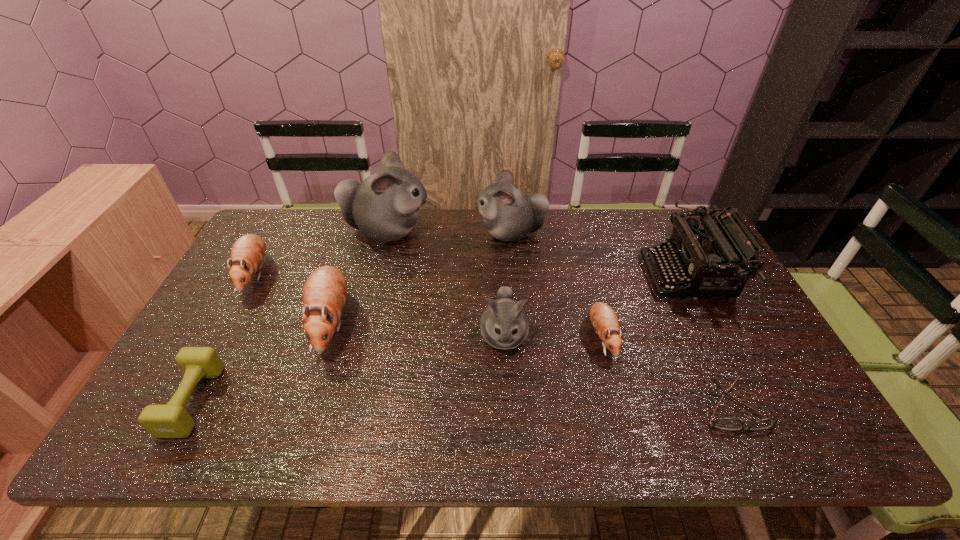
Identify the location of free spot located 0.170m at the face of the biggest brown hamster. Image resolution: width=960 pixels, height=540 pixels. (296, 430).

Find the location of a particular element. The height and width of the screenshot is (540, 960). free location located 0.240m at the face of the second smallest brown hamster is located at coordinates (201, 373).

Where is `blank space located 0.140m at the face of the shortest hamster`? The image size is (960, 540). blank space located 0.140m at the face of the shortest hamster is located at coordinates (622, 416).

Locate an element on the screen. This screenshot has width=960, height=540. free location located on the back of the dumbbell is located at coordinates (252, 288).

The image size is (960, 540). In order to click on typewriter at the far edge in this screenshot , I will do `click(695, 255)`.

I want to click on dumbbell located in the near edge section of the desktop, so click(171, 420).

At what (x,y) coordinates should I click in order to perform the action: click on spectacles present at the near edge. Please return your answer as a coordinate pair (x, y). Looking at the image, I should click on (723, 423).

The image size is (960, 540). I want to click on hamster located in the left edge section of the desktop, so click(247, 254).

Image resolution: width=960 pixels, height=540 pixels. What are the coordinates of `dumbbell that is at the left edge` in the screenshot? It's located at (171, 420).

Image resolution: width=960 pixels, height=540 pixels. In order to click on typewriter that is at the right edge in this screenshot , I will do `click(695, 255)`.